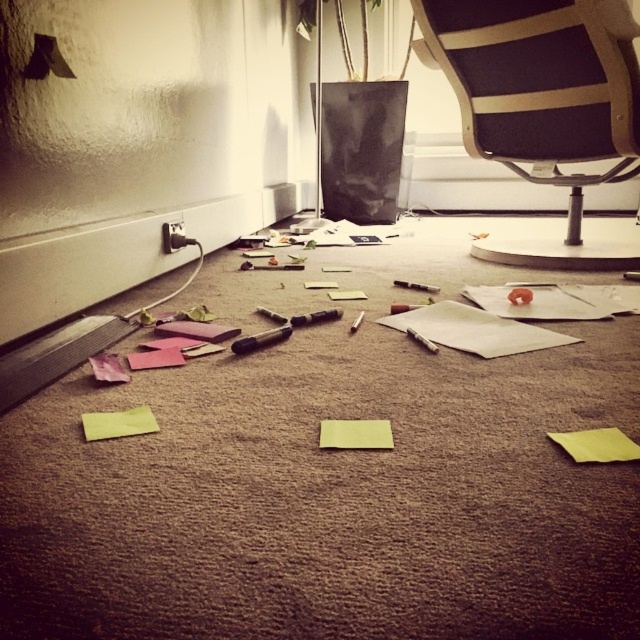
Question: Which point is farther from the camera taking this photo?

Choices:
 (A) (136, 428)
 (B) (272, 330)
 (C) (624, 454)
 (D) (374, 436)

Answer: (B)

Question: Which point appears farthest from the camera in this image?

Choices:
 (A) (412, 310)
 (B) (83, 417)

Answer: (A)

Question: Does yellow matte sticky note at center have a smaller size compared to yellow paper at center?

Choices:
 (A) yes
 (B) no

Answer: (A)

Question: Does black mesh swivel chair at upper right appear under white paper at center?

Choices:
 (A) no
 (B) yes

Answer: (A)

Question: Does black mesh swivel chair at upper right appear on the left side of yellow paper at center?

Choices:
 (A) yes
 (B) no

Answer: (B)

Question: Which is nearer to the yellow matte sticky note at center?

Choices:
 (A) yellow paper at center
 (B) black plastic screwdriver at center
 (C) white paper at center
 (D) black mesh swivel chair at upper right

Answer: (A)